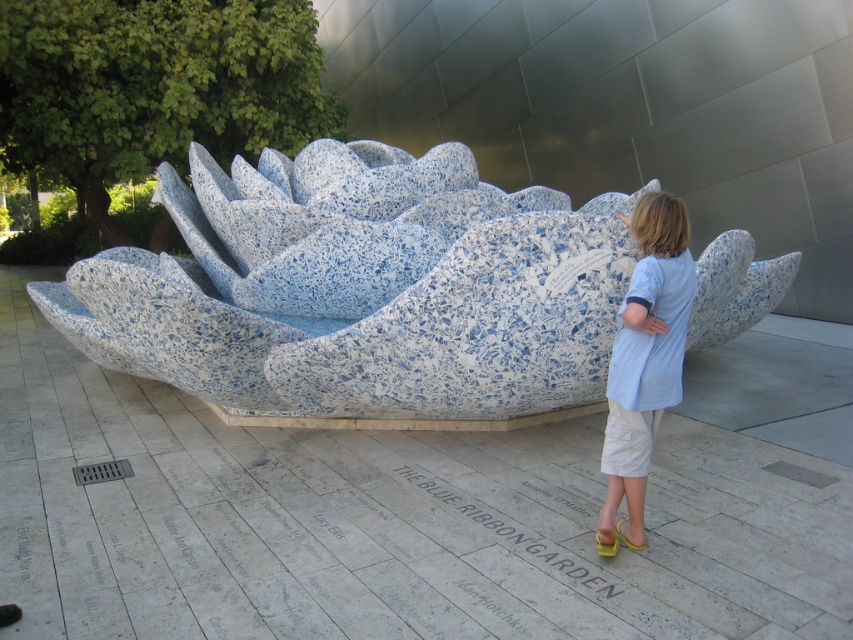
Locate an element on the screen. This screenshot has height=640, width=853. speckled stone lotus at center is located at coordinates (390, 291).